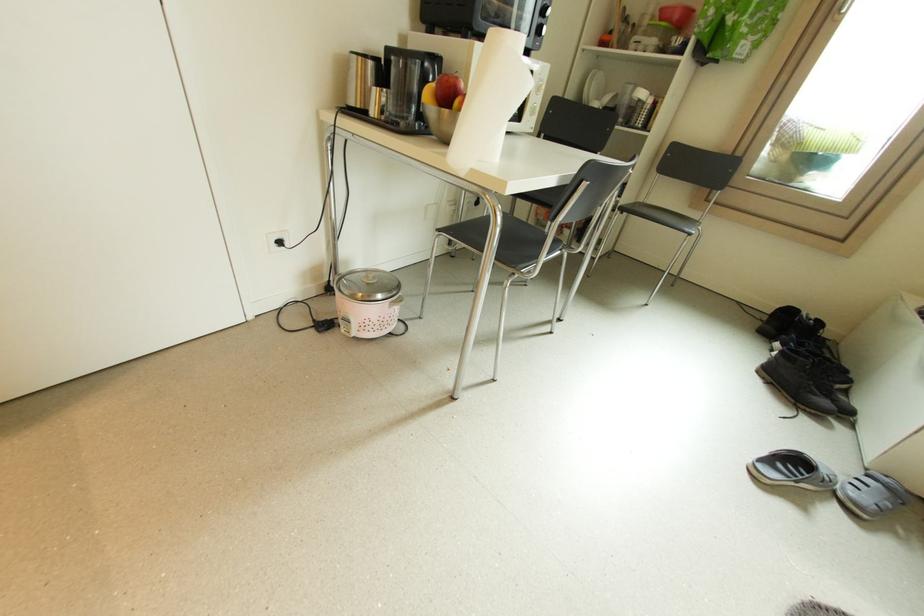
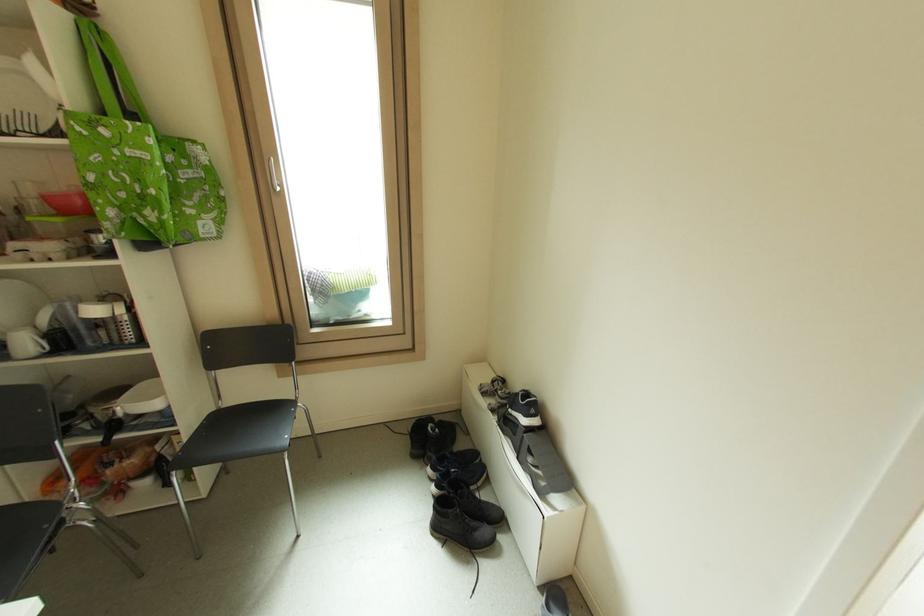
The point at (830, 403) is marked in the first image. Where is the corresponding point in the second image?

(490, 532)